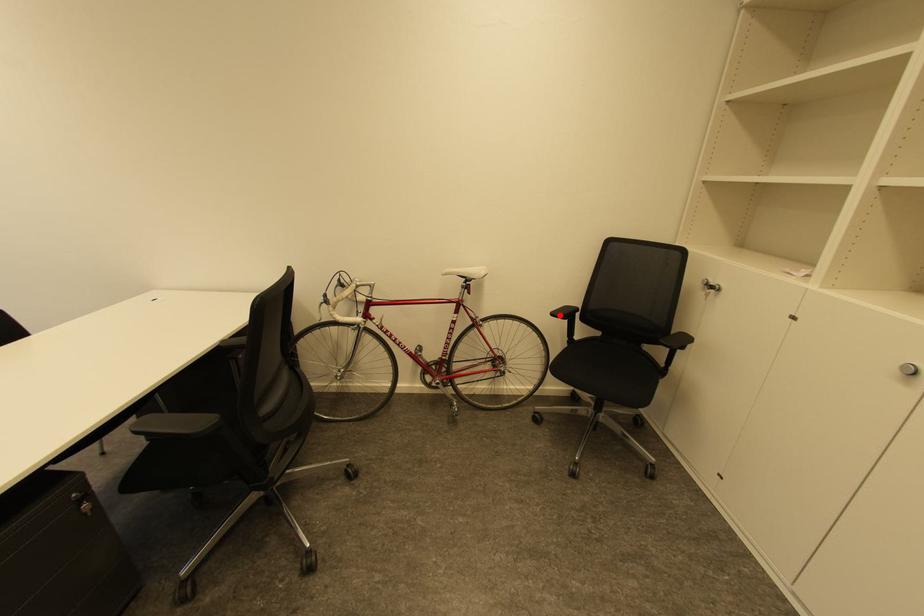
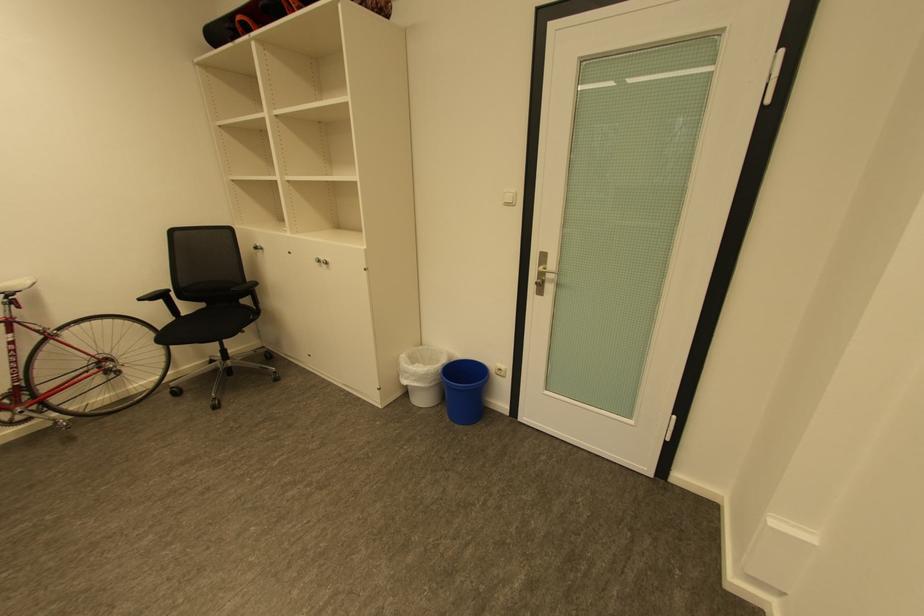
Question: I am providing you with two images of the same scene from different viewpoints. A red point is marked on the first image. Is the red point's position out of view in image 2?

Choices:
 (A) Yes
 (B) No

Answer: (B)